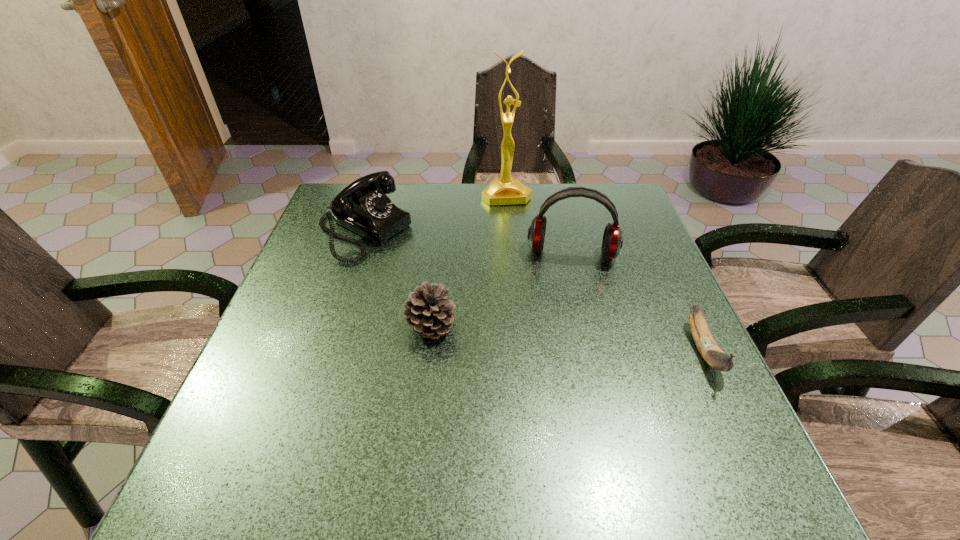
Where is `free space at the near left corner of the desktop`? The image size is (960, 540). free space at the near left corner of the desktop is located at coordinates (244, 441).

The image size is (960, 540). What are the coordinates of `vacant region between the pinecone and the banana` in the screenshot? It's located at (567, 339).

At what (x,y) coordinates should I click in order to perform the action: click on free space between the rightmost object and the leftmost object. Please return your answer as a coordinate pair (x, y). The image size is (960, 540). Looking at the image, I should click on (534, 291).

At what (x,y) coordinates should I click in order to perform the action: click on vacant space that's between the telephone and the tallest object. Please return your answer as a coordinate pair (x, y). Image resolution: width=960 pixels, height=540 pixels. Looking at the image, I should click on (435, 213).

This screenshot has height=540, width=960. Find the location of `free spot between the fourth shortest object and the telephone`. free spot between the fourth shortest object and the telephone is located at coordinates (468, 242).

The width and height of the screenshot is (960, 540). What are the coordinates of `vacant area that lies between the fourth tallest object and the fourth shortest object` in the screenshot? It's located at (501, 290).

Where is `free space between the banana and the earphone`? The height and width of the screenshot is (540, 960). free space between the banana and the earphone is located at coordinates (637, 302).

Locate an element on the screen. The width and height of the screenshot is (960, 540). vacant area between the shortest object and the telephone is located at coordinates (534, 291).

Locate an element on the screen. vacant space that is in between the fourth tallest object and the shortest object is located at coordinates (567, 339).

The height and width of the screenshot is (540, 960). Find the location of `object that stands as the second closest to the tallest object`. object that stands as the second closest to the tallest object is located at coordinates (363, 206).